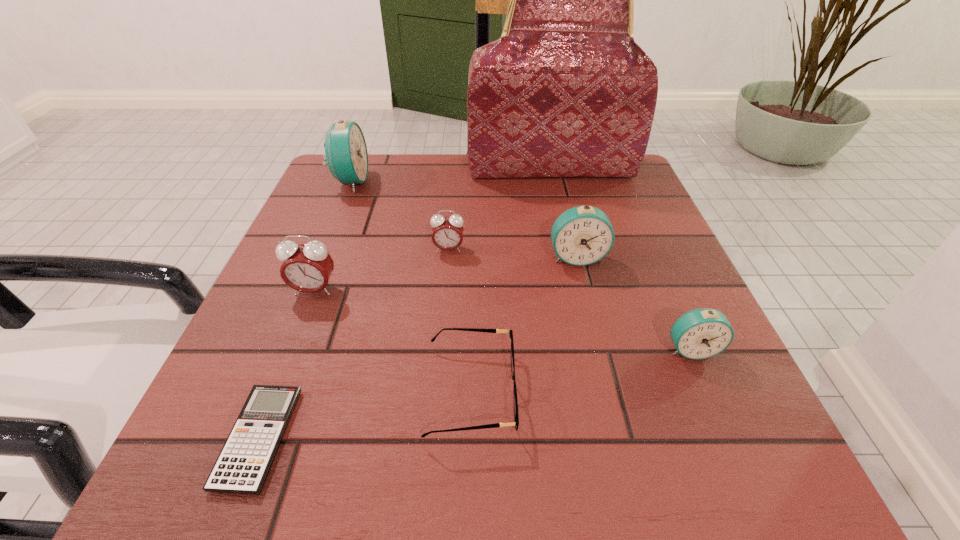
This screenshot has width=960, height=540. Identify the location of alarm clock that can be found as the third closest to the second blue alarm clock from right to left. coord(307,268).

Where is `blue alarm clock that is the second closest to the shortest object`? The width and height of the screenshot is (960, 540). blue alarm clock that is the second closest to the shortest object is located at coordinates (346, 154).

Identify which blue alarm clock is located as the second nearest to the tallest object. Please provide its 2D coordinates. Your answer should be formatted as a tuple, i.e. [(x, y)], where the tuple contains the x and y coordinates of a point satisfying the conditions above.

[(582, 235)]

In order to click on vacant space that satisfies the following two spatial constraints: 1. on the back side of the calculator; 2. on the front-facing side of the farthest blue alarm clock in this screenshot , I will do `click(358, 181)`.

The width and height of the screenshot is (960, 540). I want to click on free space that satisfies the following two spatial constraints: 1. on the clock face of the left pink alarm clock; 2. on the right side of the calculator, so click(x=256, y=438).